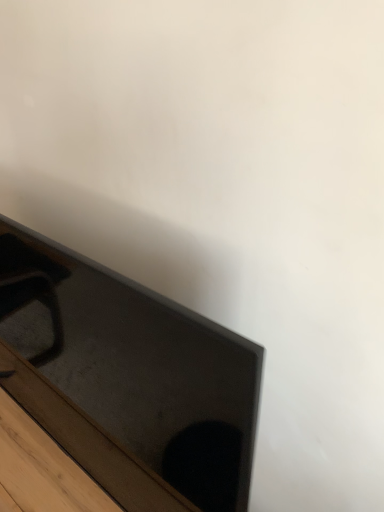
You are a GUI agent. You are given a task and a screenshot of the screen. Output one action in this format:
    pyautogui.click(x=<x>, y=<y>)
    Task: Click on the free point below matte black tv at lower left (from a real-world perspective)
    
    Given the screenshot: What is the action you would take?
    pyautogui.click(x=42, y=451)